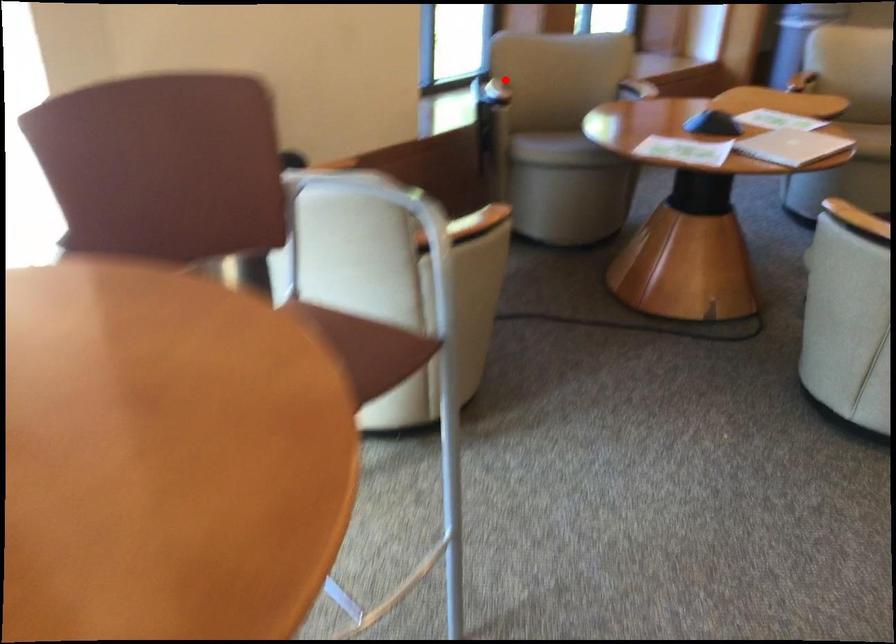
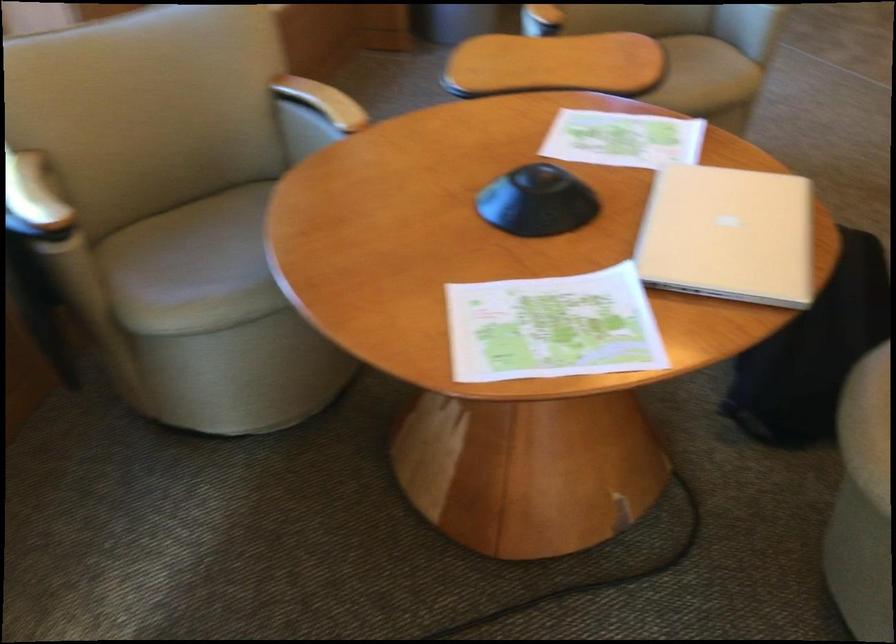
Locate, in the second image, the point that corresponds to the highlighted location in the first image.

(33, 200)